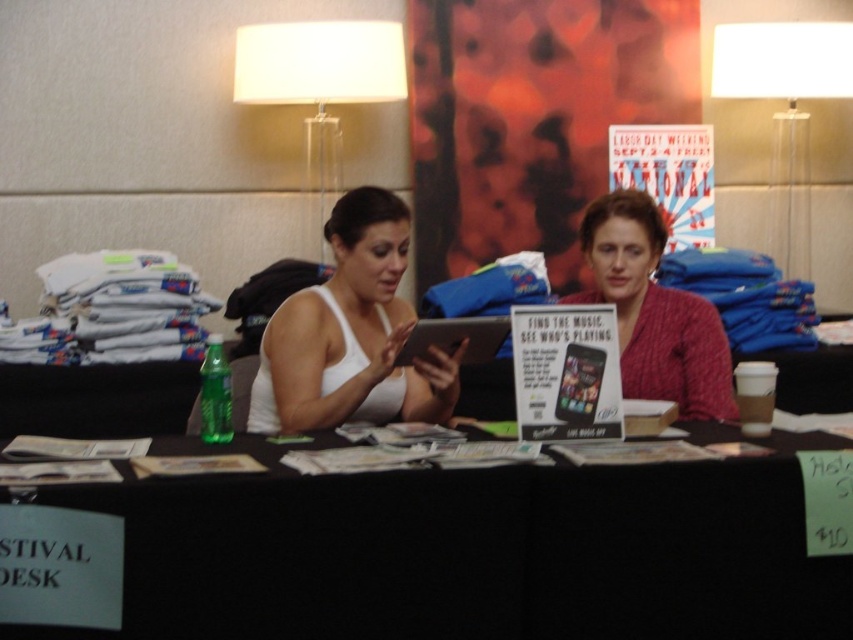
You are a photographer at a convention and need to take a photo of both the white matte tank top at center and the knitted red sweater at center. Based on their positions, which one is located to the left of the other?

The white matte tank top at center is positioned on the left side of knitted red sweater at center, so it is located to the left of the knitted red sweater at center.

What object is located at the coordinates point (426, 554) in the image?

The point (426, 554) marks the black fabric table at center.

You are setting up a camera on a tripod to take a photo of the black fabric table at center and the white plastic lamp at upper right. The tripod can only hold items up to 1 meter in height. Can you safely place both items on the tripod without exceeding the height limit?

The black fabric table at center is taller than the white plastic lamp at upper right. Since the tripod can only hold items up to 1 meter in height, you need to check the height of the black fabric table at center. If it is under 1 meter, both can be placed safely. If not, the taller black fabric table at center may exceed the limit.